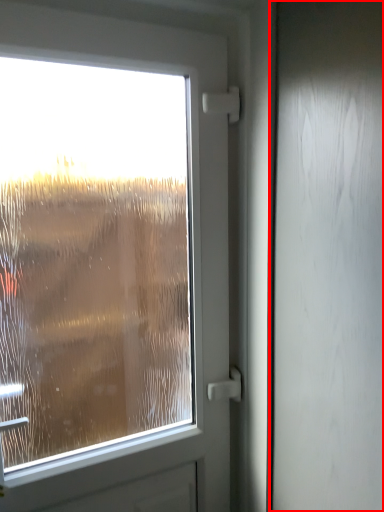
Question: From the image's perspective, what is the correct spatial relationship of screen door (annotated by the red box) in relation to airplane window?

Choices:
 (A) above
 (B) below

Answer: (A)